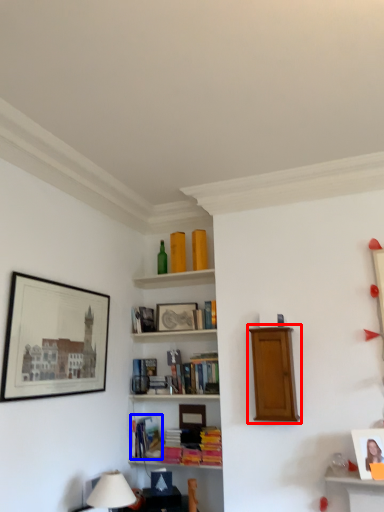
Question: Which object appears closest to the camera in this image, shelf (highlighted by a red box) or book (highlighted by a blue box)?

Choices:
 (A) shelf
 (B) book

Answer: (A)